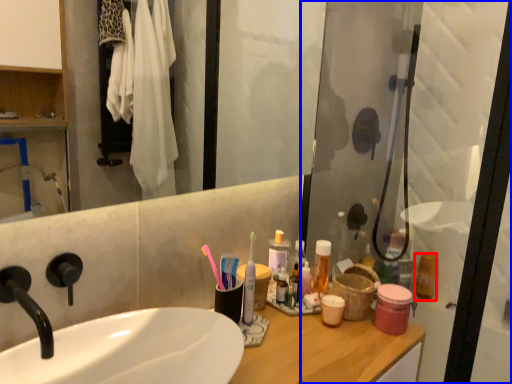
Question: Which object appears farthest to the camera in this image, mouthwash (highlighted by a red box) or screen door (highlighted by a blue box)?

Choices:
 (A) mouthwash
 (B) screen door

Answer: (A)